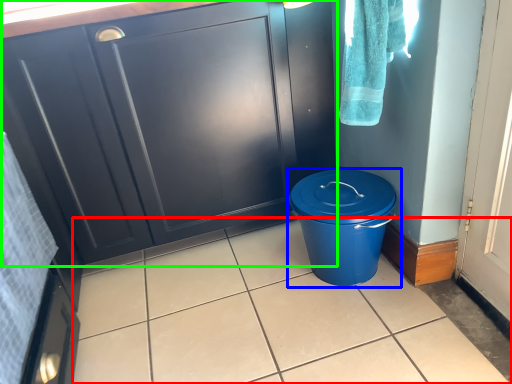
Question: Which object is the farthest from tile (highlighted by a red box)? Choose among these: waste container (highlighted by a blue box) or cabinetry (highlighted by a green box).

Choices:
 (A) waste container
 (B) cabinetry

Answer: (B)